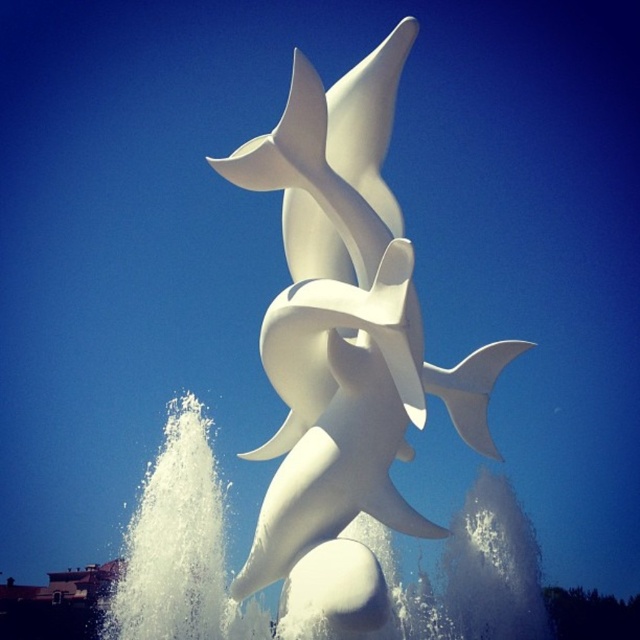
Question: Which point is closer to the camera?

Choices:
 (A) (339, 481)
 (B) (403, 620)

Answer: (B)

Question: Is white glossy dolphins at center positioned in front of white frothy water at center?

Choices:
 (A) no
 (B) yes

Answer: (A)

Question: Is white glossy dolphins at center positioned before white frothy water at center?

Choices:
 (A) no
 (B) yes

Answer: (A)

Question: Which point is farther from the camera taking this photo?

Choices:
 (A) (316, 365)
 (B) (468, 628)

Answer: (B)

Question: In this image, where is white glossy dolphins at center located relative to white frothy water at center?

Choices:
 (A) right
 (B) left

Answer: (A)